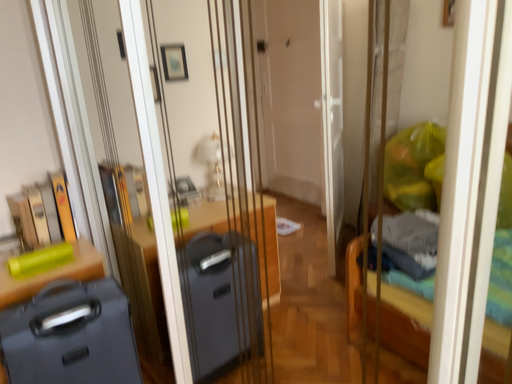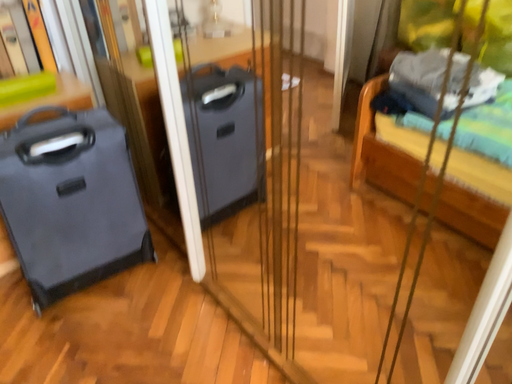
Question: How did the camera likely rotate when shooting the video?

Choices:
 (A) rotated downward
 (B) rotated upward

Answer: (A)